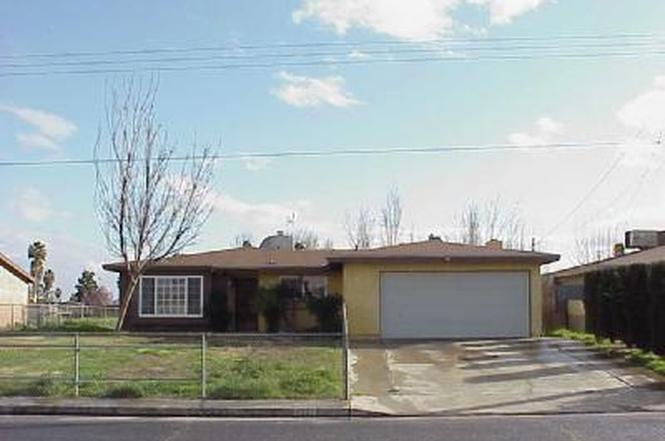
The height and width of the screenshot is (441, 665). I want to click on two sliding window panels, so click(194, 291), click(144, 296).